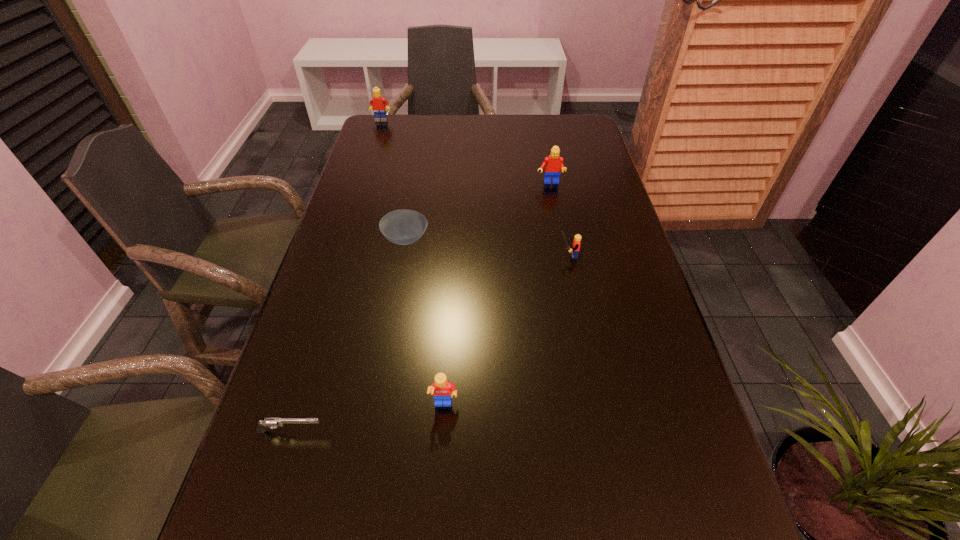
Where is `object located in the far left corner section of the desktop`? The image size is (960, 540). object located in the far left corner section of the desktop is located at coordinates (377, 103).

Where is `vacant space at the far edge of the desktop`? vacant space at the far edge of the desktop is located at coordinates 438,141.

The height and width of the screenshot is (540, 960). In the image, there is a desktop. What are the coordinates of `free region at the left edge` in the screenshot? It's located at (366, 247).

This screenshot has width=960, height=540. Identify the location of vacant area at the right edge of the desktop. (669, 384).

Image resolution: width=960 pixels, height=540 pixels. Find the location of `vacant space at the far left corner of the desktop`. vacant space at the far left corner of the desktop is located at coordinates (401, 124).

The width and height of the screenshot is (960, 540). In the image, there is a desktop. What are the coordinates of `vacant region at the far right corner` in the screenshot? It's located at (584, 131).

At what (x,y) coordinates should I click in order to perform the action: click on empty location between the farthest object and the third object from right to left. Please return your answer as a coordinate pair (x, y). This screenshot has width=960, height=540. Looking at the image, I should click on (413, 263).

Where is `empty space between the pistol and the second nearest object`? empty space between the pistol and the second nearest object is located at coordinates (368, 418).

The image size is (960, 540). What are the coordinates of `vacant region between the fourth object from right to left and the second farthest object` in the screenshot? It's located at (478, 211).

Locate an element on the screen. Image resolution: width=960 pixels, height=540 pixels. free space between the fifth farthest object and the fourth object from right to left is located at coordinates (425, 322).